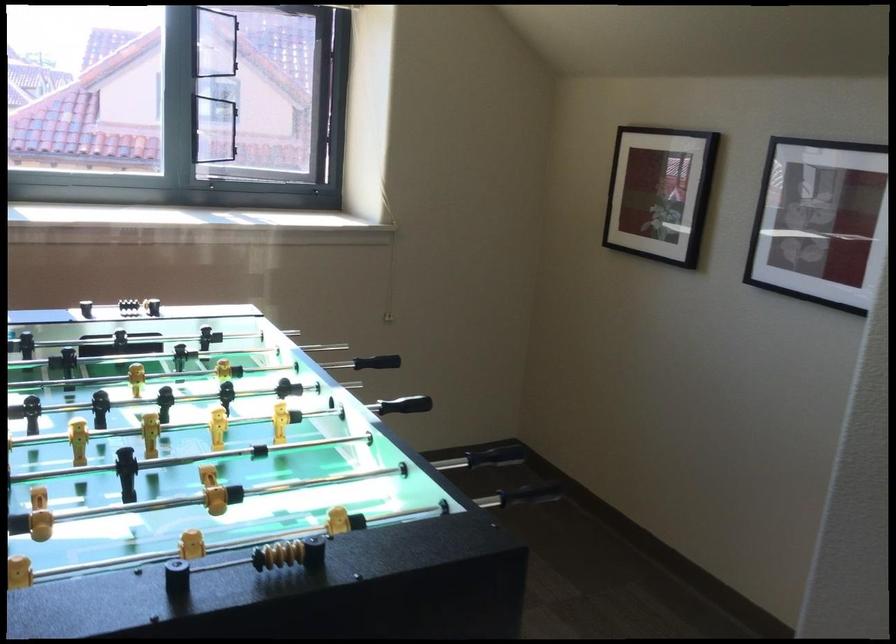
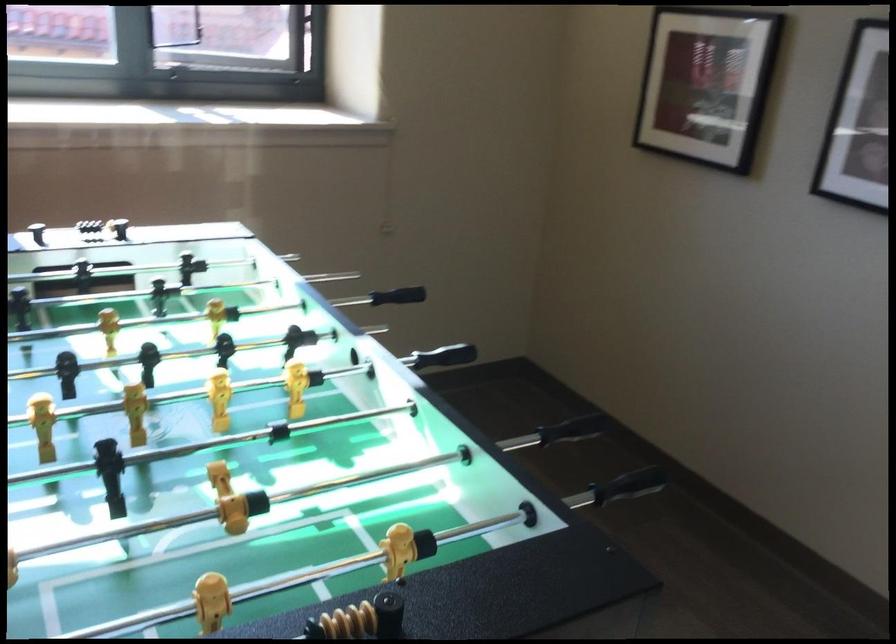
What movement of the cameraman would produce the second image?

The cameraman walked toward left, forward.